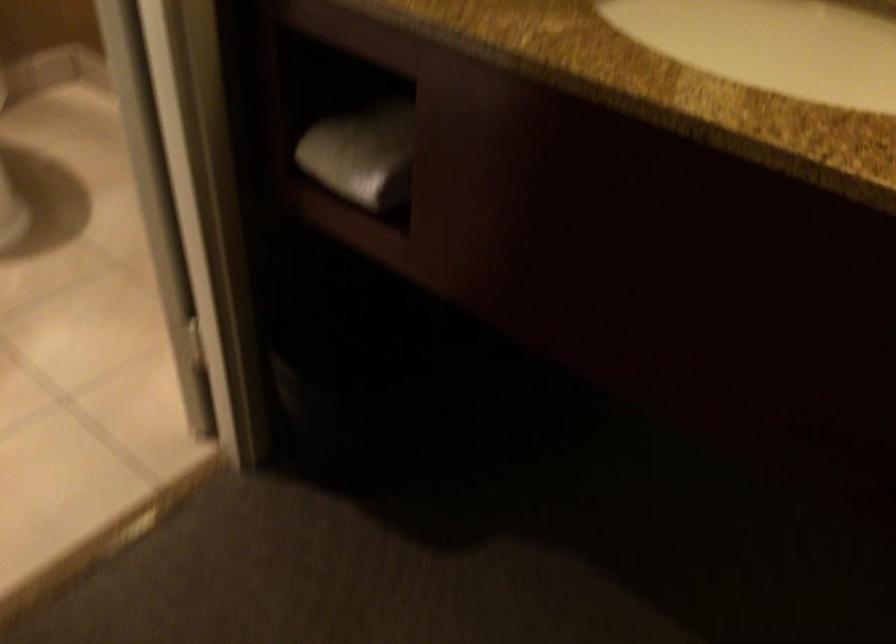
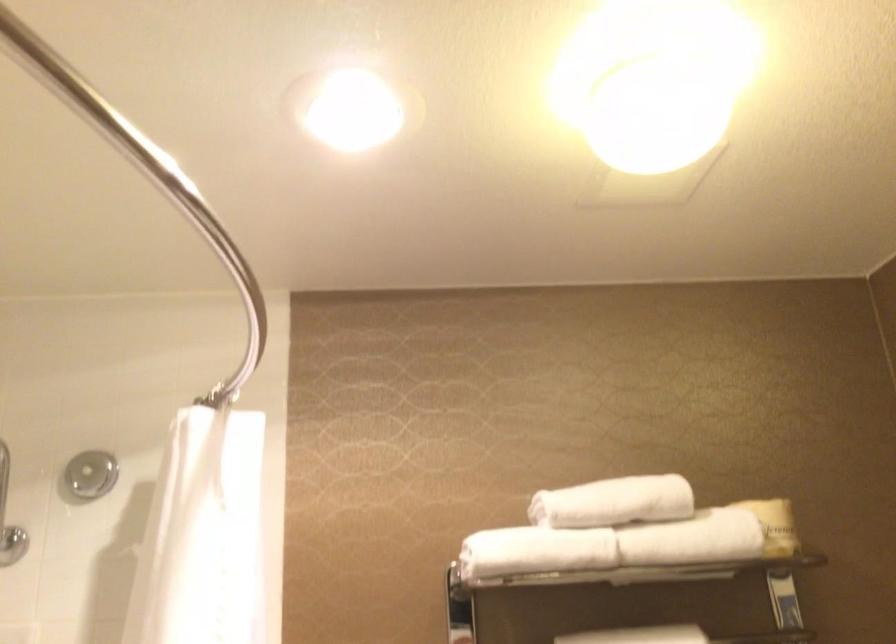
The images are taken continuously from a first-person perspective. In which direction is your viewpoint rotating?

The camera rotated toward left-up.